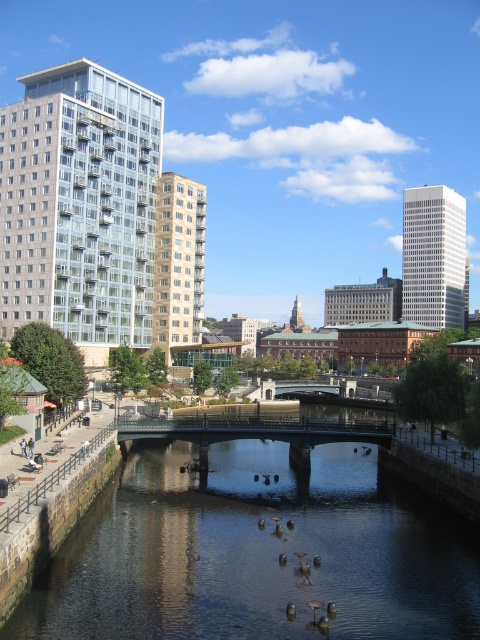
Question: Is dark reflective water at center in front of metallic gray bridge at center?

Choices:
 (A) no
 (B) yes

Answer: (B)

Question: Which object is farther from the camera taking this photo?

Choices:
 (A) dark reflective water at center
 (B) metallic gray bridge at center

Answer: (B)

Question: Is dark reflective water at center closer to the viewer compared to metallic gray bridge at center?

Choices:
 (A) yes
 (B) no

Answer: (A)

Question: Which object appears closest to the camera in this image?

Choices:
 (A) metallic gray bridge at center
 (B) dark reflective water at center

Answer: (B)

Question: Can you confirm if dark reflective water at center is smaller than metallic gray bridge at center?

Choices:
 (A) yes
 (B) no

Answer: (A)